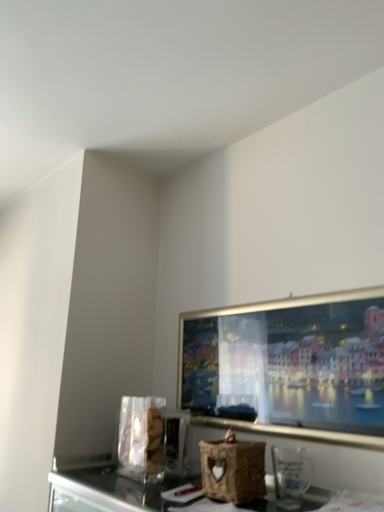
Describe the element at coordinates (233, 470) in the screenshot. I see `woven brown basket at center` at that location.

This screenshot has height=512, width=384. Find the location of `woven brown basket at center`. woven brown basket at center is located at coordinates (233, 470).

In order to face woven brown basket at center, should I rotate leftwards or rightwards?

You should look right and rotate roughly 5.135 degrees.

Identify the location of transparent glass at lower right. The width and height of the screenshot is (384, 512). (291, 476).

In the scene shown: Measure the distance between transparent glass at lower right and camera.

They are 1.08 meters apart.

This screenshot has width=384, height=512. What do you see at coordinates (291, 476) in the screenshot?
I see `transparent glass at lower right` at bounding box center [291, 476].

The image size is (384, 512). I want to click on woven brown basket at center, so click(x=233, y=470).

Between woven brown basket at center and transparent glass at lower right, which one appears on the left side from the viewer's perspective?

woven brown basket at center.

From the picture: Is woven brown basket at center in front of or behind transparent glass at lower right in the image?

woven brown basket at center is positioned farther from the viewer than transparent glass at lower right.

Based on the photo, which point is more distant from viewer, (205, 480) or (305, 470)?

The point (305, 470) is behind.

From the image's perspective, is woven brown basket at center on transparent glass at lower right?

No.

From a real-world perspective, who is located higher, woven brown basket at center or transparent glass at lower right?

From a 3D spatial view, transparent glass at lower right is above.

Considering the relative sizes of woven brown basket at center and transparent glass at lower right in the image provided, is woven brown basket at center thinner than transparent glass at lower right?

In fact, woven brown basket at center might be wider than transparent glass at lower right.

Is woven brown basket at center shorter than transparent glass at lower right?

Incorrect, the height of woven brown basket at center does not fall short of that of transparent glass at lower right.

Considering the sizes of woven brown basket at center and transparent glass at lower right in the image, is woven brown basket at center bigger or smaller than transparent glass at lower right?

Considering their sizes, woven brown basket at center takes up more space than transparent glass at lower right.

Would you say woven brown basket at center is inside or outside transparent glass at lower right?

woven brown basket at center is outside transparent glass at lower right.

In the scene shown: Is woven brown basket at center far away from transparent glass at lower right?

No, there isn't a large distance between woven brown basket at center and transparent glass at lower right.

Is woven brown basket at center positioned with its back to transparent glass at lower right?

That's not correct — woven brown basket at center is not looking away from transparent glass at lower right.

You are a GUI agent. You are given a task and a screenshot of the screen. Output one action in this format:
    pyautogui.click(x=<x>, y=<y>)
    Task: Click on the basket behind the transparent glass at lower right
    Image resolution: width=384 pixels, height=512 pixels.
    Given the screenshot: What is the action you would take?
    click(233, 470)

Considering the positions of objects transparent glass at lower right and woven brown basket at center in the image provided, who is more to the right, transparent glass at lower right or woven brown basket at center?

transparent glass at lower right is more to the right.

Which is in front, transparent glass at lower right or woven brown basket at center?

Positioned in front is transparent glass at lower right.

Considering the positions of point (300, 458) and point (234, 494), is point (300, 458) closer or farther from the camera than point (234, 494)?

Point (300, 458) is positioned farther from the camera compared to point (234, 494).

From the image's perspective, is transparent glass at lower right above or below woven brown basket at center?

transparent glass at lower right is above woven brown basket at center.

From a real-world perspective, who is located lower, transparent glass at lower right or woven brown basket at center?

woven brown basket at center.

Looking at their sizes, would you say transparent glass at lower right is wider or thinner than woven brown basket at center?

Considering their sizes, transparent glass at lower right looks slimmer than woven brown basket at center.

Does transparent glass at lower right have a lesser height compared to woven brown basket at center?

Correct, transparent glass at lower right is not as tall as woven brown basket at center.

Does transparent glass at lower right have a larger size compared to woven brown basket at center?

Actually, transparent glass at lower right might be smaller than woven brown basket at center.

Can woven brown basket at center be found inside transparent glass at lower right?

Actually, woven brown basket at center is outside transparent glass at lower right.

Is transparent glass at lower right directly adjacent to woven brown basket at center?

No, transparent glass at lower right is not touching woven brown basket at center.

Is woven brown basket at center at the back of transparent glass at lower right?

No, transparent glass at lower right is not facing the opposite direction of woven brown basket at center.

The width and height of the screenshot is (384, 512). Find the location of `appliance on the right of woven brown basket at center`. appliance on the right of woven brown basket at center is located at coordinates (291, 476).

This screenshot has width=384, height=512. What are the coordinates of `appliance lying in front of the woven brown basket at center` in the screenshot? It's located at (291, 476).

Image resolution: width=384 pixels, height=512 pixels. I want to click on appliance that is above the woven brown basket at center (from the image's perspective), so click(x=291, y=476).